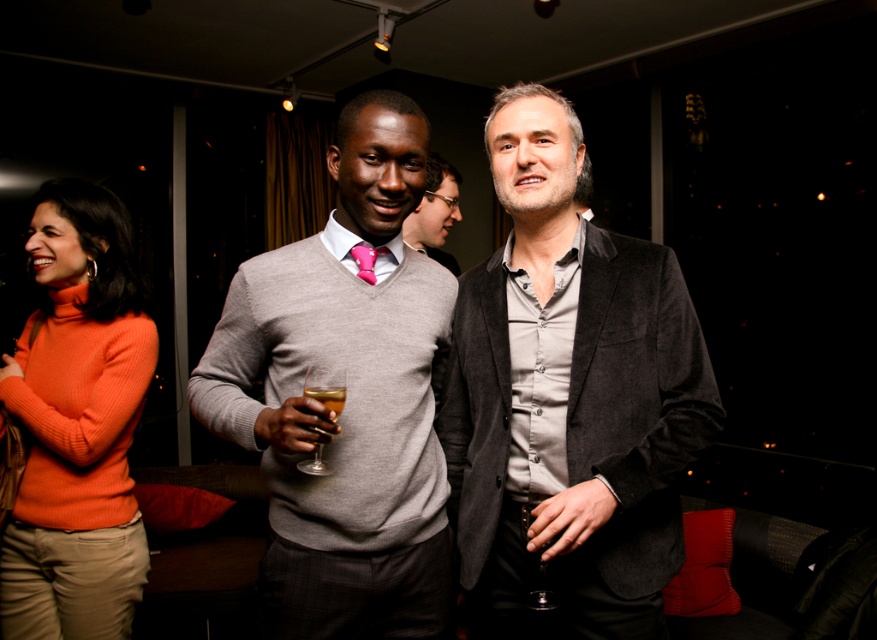
Is velvet black blazer at center positioned in front of matte gray sweater at center?

No, it is not.

Does velvet black blazer at center have a greater height compared to matte gray sweater at center?

Yes, velvet black blazer at center is taller than matte gray sweater at center.

The image size is (877, 640). In order to click on velvet black blazer at center in this screenshot , I will do `click(568, 397)`.

You are a GUI agent. You are given a task and a screenshot of the screen. Output one action in this format:
    pyautogui.click(x=<x>, y=<y>)
    Task: Click on the velvet black blazer at center
    
    Given the screenshot: What is the action you would take?
    pyautogui.click(x=568, y=397)

Which is in front, point (82, 540) or point (538, 596)?

Positioned in front is point (538, 596).

At what (x,y) coordinates should I click in order to perform the action: click on orange turtleneck sweater at left. Please return your answer as a coordinate pair (x, y). Looking at the image, I should click on (77, 422).

Is point (262, 612) in front of point (317, 392)?

That is False.

Can you confirm if matte gray sweater at center is positioned to the right of translucent glass wine at center?

Incorrect, matte gray sweater at center is not on the right side of translucent glass wine at center.

Does point (429, 326) come in front of point (318, 387)?

No.

This screenshot has width=877, height=640. I want to click on matte gray sweater at center, so point(347,396).